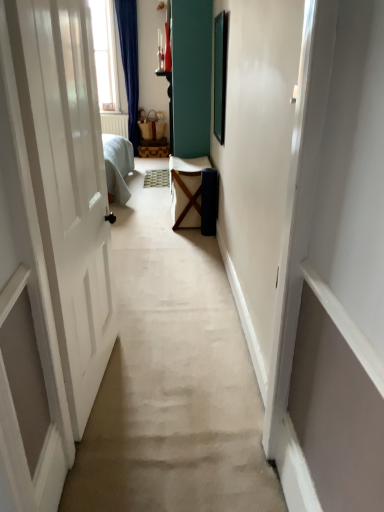
What do you see at coordinates (186, 190) in the screenshot?
I see `brown leather chair at center` at bounding box center [186, 190].

What is the approximate width of brown leather chair at center?

15.84 inches.

Where is `brown leather chair at center`? brown leather chair at center is located at coordinates (186, 190).

At what (x,y) coordinates should I click in order to perform the action: click on brown leather chair at center. Please return your answer as a coordinate pair (x, y). Looking at the image, I should click on (186, 190).